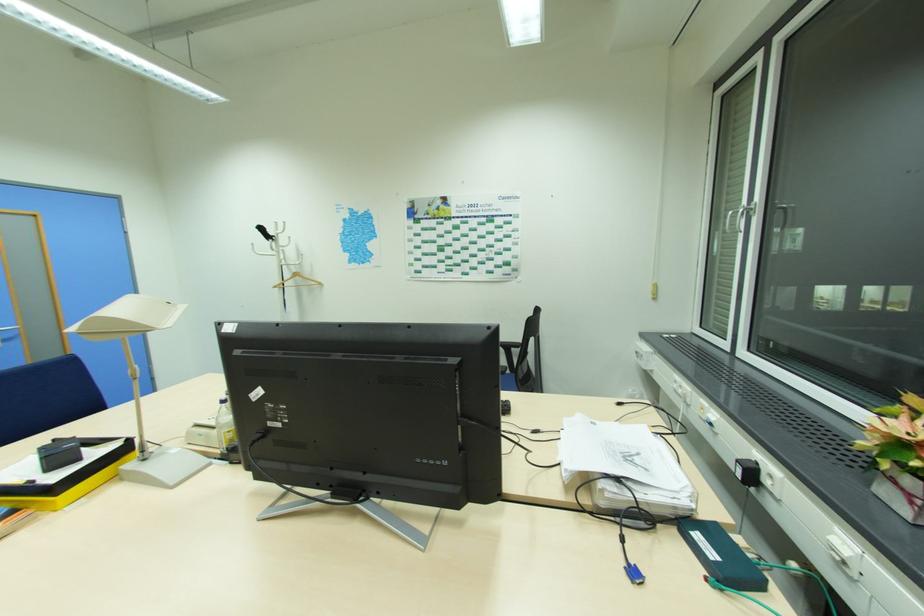
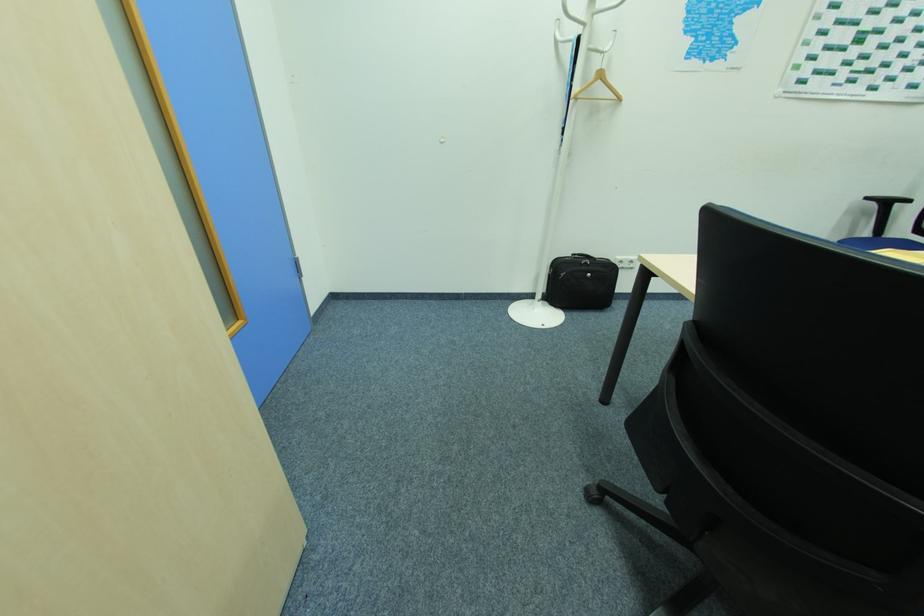
Which direction would the cameraman need to move to produce the second image?

The movement direction of the cameraman is left, forward.